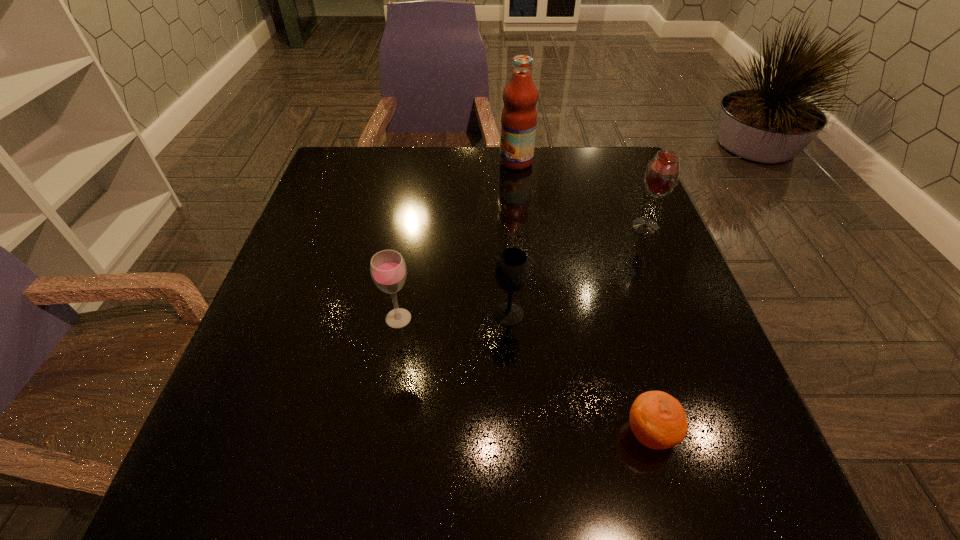
The height and width of the screenshot is (540, 960). In the image, there is a desktop. What are the coordinates of `vacant space at the far edge` in the screenshot? It's located at (428, 174).

I want to click on free space at the near edge of the desktop, so click(645, 500).

Find the location of a particular element. The width and height of the screenshot is (960, 540). vacant space at the left edge of the desktop is located at coordinates (288, 250).

This screenshot has width=960, height=540. What are the coordinates of `free space at the right edge of the desktop` in the screenshot? It's located at (696, 327).

This screenshot has width=960, height=540. Find the location of `free spot at the near right corner of the desktop`. free spot at the near right corner of the desktop is located at coordinates (766, 461).

Find the location of a particular element. Image resolution: width=960 pixels, height=540 pixels. vacant space that's between the orange and the leftmost wineglass is located at coordinates (524, 376).

Locate an element on the screen. The width and height of the screenshot is (960, 540). free space between the second wineglass from left to right and the shortest object is located at coordinates (579, 374).

At what (x,y) coordinates should I click in order to perform the action: click on free space that is in between the rightmost wineglass and the shortest object. Please return your answer as a coordinate pair (x, y). Looking at the image, I should click on (647, 330).

Where is `vacant region between the shortest object and the leftmost wineglass`? Image resolution: width=960 pixels, height=540 pixels. vacant region between the shortest object and the leftmost wineglass is located at coordinates (524, 376).

Image resolution: width=960 pixels, height=540 pixels. Find the location of `free space between the tallest object and the orange`. free space between the tallest object and the orange is located at coordinates (583, 298).